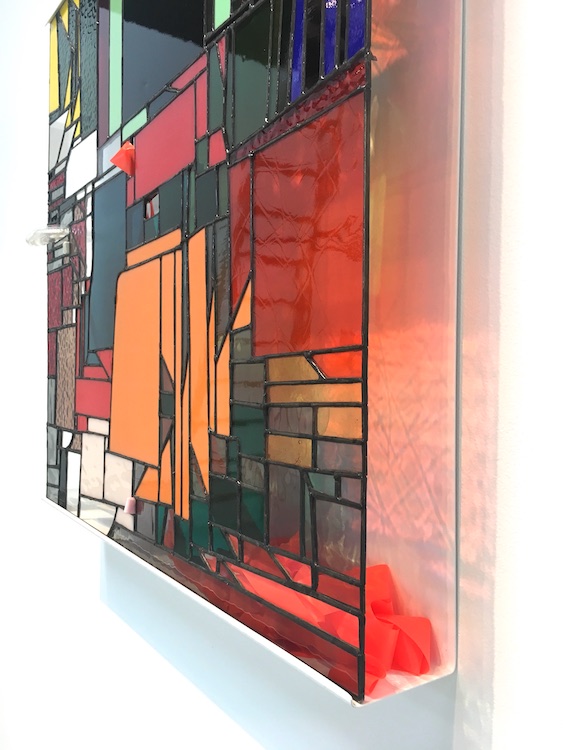
Locate an element on the screen. This screenshot has height=750, width=563. glass is located at coordinates (64, 415).